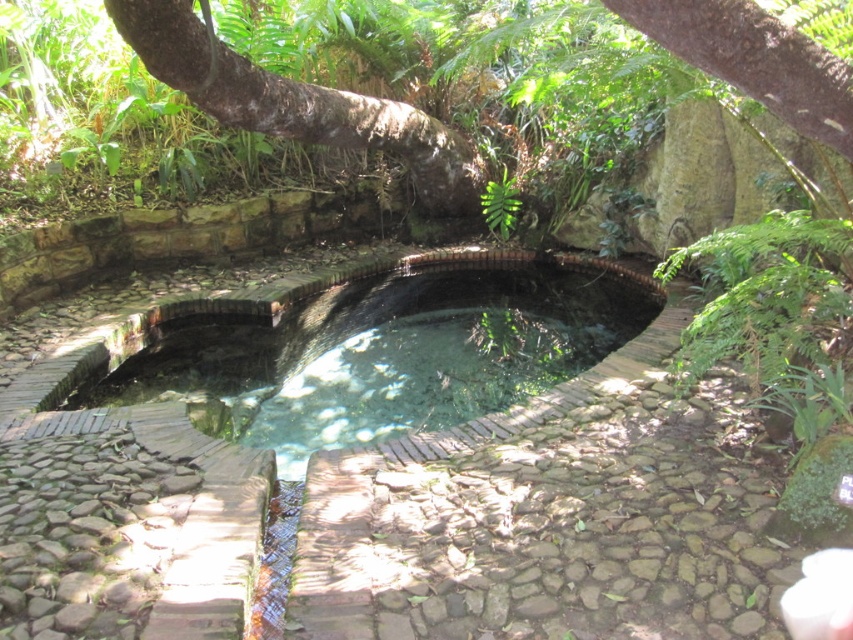
Can you confirm if brown rough bark tree at upper center is positioned above green leafy fern at center?

Correct, brown rough bark tree at upper center is located above green leafy fern at center.

Can you confirm if brown rough bark tree at upper center is thinner than green leafy fern at center?

No, brown rough bark tree at upper center is not thinner than green leafy fern at center.

Between point (454, 172) and point (502, 200), which one is positioned in front?

Positioned in front is point (454, 172).

The width and height of the screenshot is (853, 640). What are the coordinates of `brown rough bark tree at upper center` in the screenshot? It's located at (294, 102).

Which is more to the left, clear glass pool at center or green leafy fern at center?

From the viewer's perspective, clear glass pool at center appears more on the left side.

Does clear glass pool at center appear on the left side of green leafy fern at center?

Correct, you'll find clear glass pool at center to the left of green leafy fern at center.

The height and width of the screenshot is (640, 853). Find the location of `clear glass pool at center`. clear glass pool at center is located at coordinates (387, 349).

Image resolution: width=853 pixels, height=640 pixels. I want to click on clear glass pool at center, so click(387, 349).

Measure the distance between clear glass pool at center and brown rough bark tree at upper center.

They are 1.69 meters apart.

Does point (424, 339) come behind point (178, 8)?

That is True.

Where is `clear glass pool at center`? clear glass pool at center is located at coordinates (387, 349).

Locate an element on the screen. clear glass pool at center is located at coordinates (387, 349).